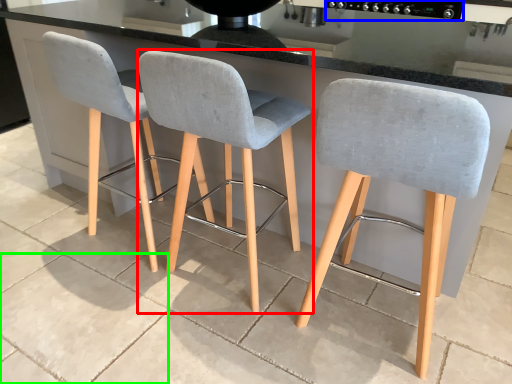
Question: Which object is the farthest from chair (highlighted by a red box)? Choose among these: appliance (highlighted by a blue box) or concrete (highlighted by a green box).

Choices:
 (A) appliance
 (B) concrete

Answer: (A)